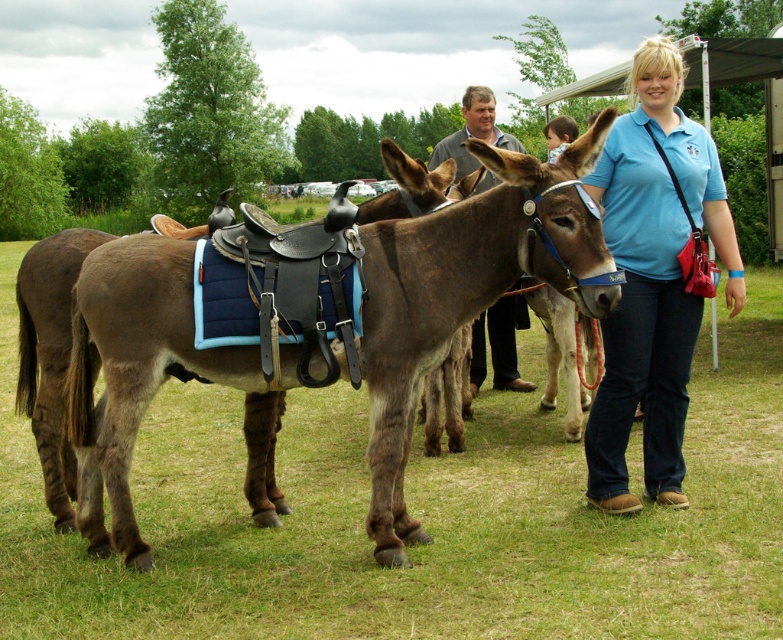
Based on the photo, you are standing at the center of the image and want to place a small picnic basket on the green grass at lower center. To ensure accuracy, what are the coordinates you should aim for?

The coordinates for the green grass at lower center are at point (417, 516).

You are a photographer planning to take a picture of the green grass at lower center and the blue cotton shirt at center. Which object will occupy more space in the photo?

The green grass at lower center will occupy more space in the photo because it is bigger than the blue cotton shirt at center.

You are a photographer standing at the edge of the grassy area. You want to take a photo that includes both the green grass at lower center and the blue cotton shirt at center. Given that your camera has a maximum focus range of 5 feet, will you be able to capture both subjects in focus without moving?

The green grass at lower center and blue cotton shirt at center are 5.68 feet apart from each other. Since the distance between them exceeds the camera maximum focus range of 5 feet, you will not be able to capture both subjects in focus without moving.